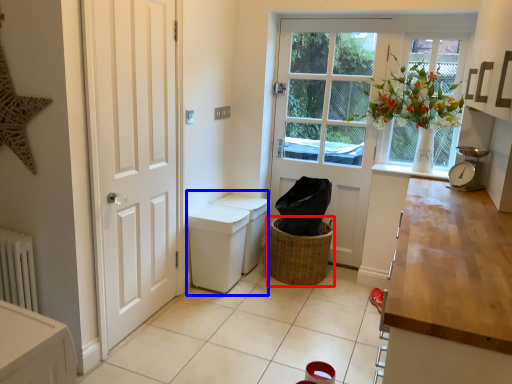
Question: Which of the following is the closest to the observer, basket (highlighted by a red box) or sink (highlighted by a blue box)?

Choices:
 (A) basket
 (B) sink

Answer: (B)